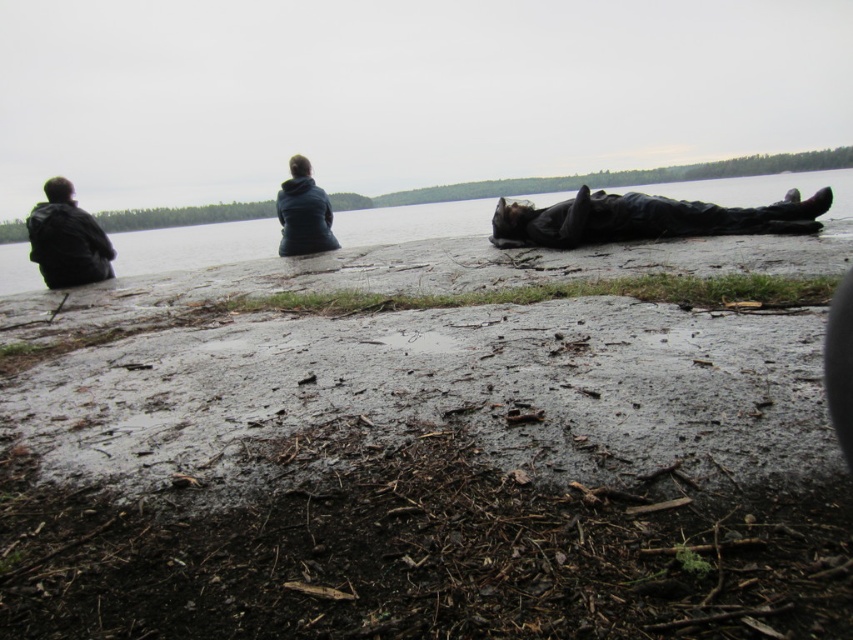
Does black matte body at center have a greater height compared to matte black jacket at left?

No, black matte body at center is not taller than matte black jacket at left.

Between black matte body at center and matte black jacket at left, which one is positioned lower?

matte black jacket at left is lower down.

Is point (566, 228) behind point (93, 253)?

That is False.

This screenshot has height=640, width=853. Find the location of `black matte body at center`. black matte body at center is located at coordinates (646, 218).

Looking at this image, can you confirm if matte black jacket at left is wider than matte blue jacket at upper center?

Yes, matte black jacket at left is wider than matte blue jacket at upper center.

Is point (67, 189) behind point (293, 189)?

No, (67, 189) is closer to viewer.

This screenshot has width=853, height=640. I want to click on matte black jacket at left, so click(67, 240).

Does point (189, 266) come closer to viewer compared to point (294, 160)?

Yes.

What do you see at coordinates (194, 244) in the screenshot?
I see `clear water at center` at bounding box center [194, 244].

Which is in front, point (146, 260) or point (325, 240)?

Point (146, 260) is in front.

Find the location of a particular element. This screenshot has height=640, width=853. clear water at center is located at coordinates (194, 244).